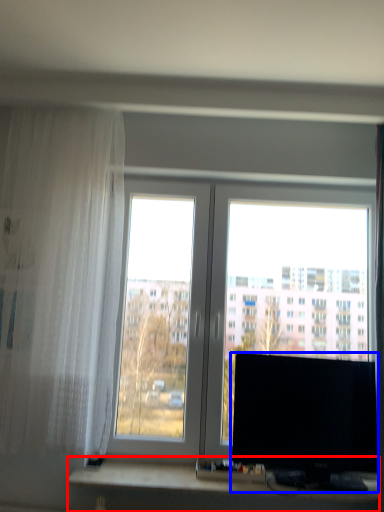
Question: Which of the following is the closest to the observer, computer desk (highlighted by a red box) or computer monitor (highlighted by a blue box)?

Choices:
 (A) computer desk
 (B) computer monitor

Answer: (B)